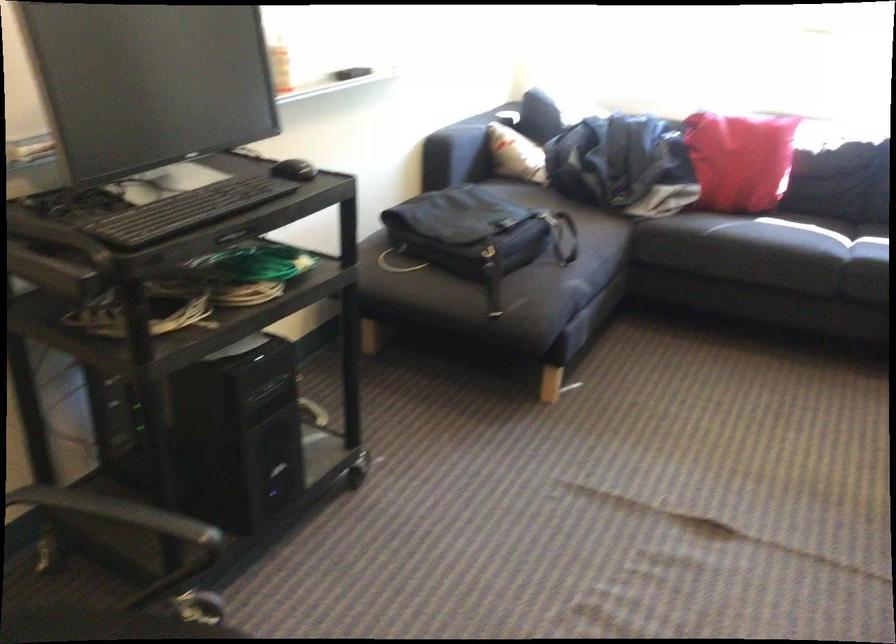
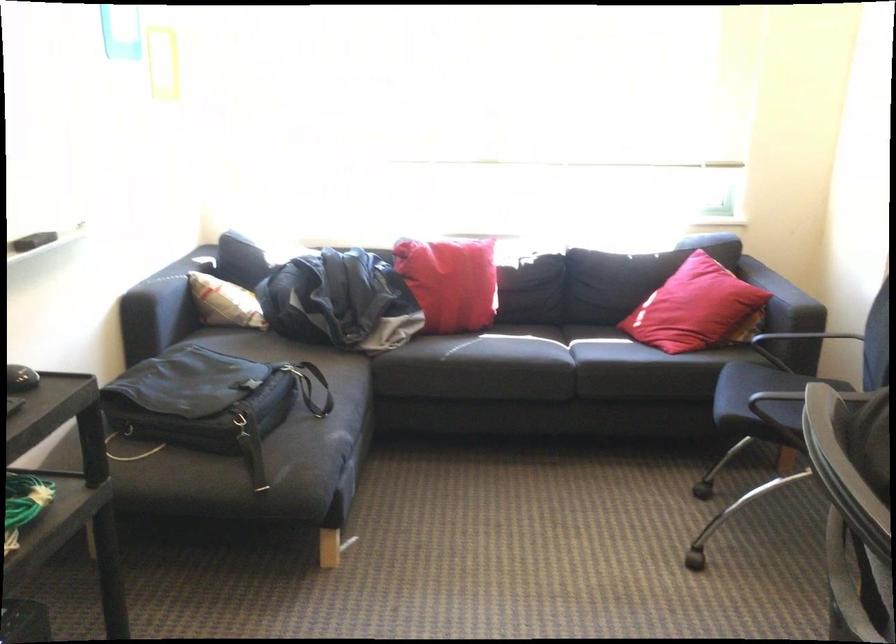
Find the pixel in the second image that matches the point at 805,254 in the first image.

(535, 364)